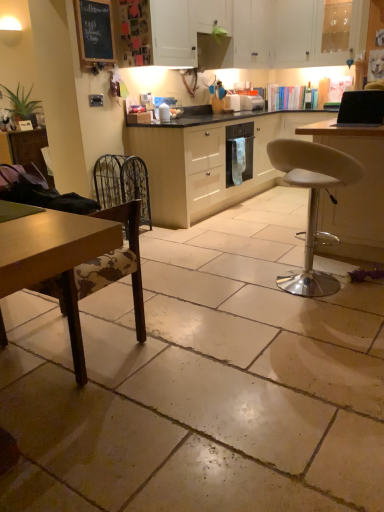
Question: Is black glossy laptop at upper right bigger than metallic oven at center, the second appliance from the front?

Choices:
 (A) yes
 (B) no

Answer: (B)

Question: Does black glossy laptop at upper right have a lesser height compared to metallic oven at center, the second appliance from the front?

Choices:
 (A) no
 (B) yes

Answer: (A)

Question: Considering the relative positions of black glossy laptop at upper right and metallic oven at center, arranged as the 1th appliance when viewed from the back, in the image provided, is black glossy laptop at upper right to the left of metallic oven at center, arranged as the 1th appliance when viewed from the back, from the viewer's perspective?

Choices:
 (A) no
 (B) yes

Answer: (A)

Question: Does black glossy laptop at upper right appear on the right side of metallic oven at center, arranged as the 1th appliance when viewed from the back?

Choices:
 (A) yes
 (B) no

Answer: (A)

Question: Is black glossy laptop at upper right facing away from metallic oven at center, the second appliance from the front?

Choices:
 (A) no
 (B) yes

Answer: (A)

Question: Looking at their shapes, would you say metallic oven at center, arranged as the 1th appliance when viewed from the back, is wider or thinner than black glossy laptop at upper right?

Choices:
 (A) thin
 (B) wide

Answer: (B)

Question: In the image, is metallic oven at center, arranged as the 1th appliance when viewed from the back, on the left side or the right side of black glossy laptop at upper right?

Choices:
 (A) left
 (B) right

Answer: (A)

Question: From the image's perspective, is metallic oven at center, the second appliance from the front, positioned above or below black glossy laptop at upper right?

Choices:
 (A) above
 (B) below

Answer: (A)

Question: Does point (243, 103) appear closer or farther from the camera than point (382, 93)?

Choices:
 (A) closer
 (B) farther

Answer: (B)

Question: In terms of height, does white plastic table at right look taller or shorter compared to metallic oven at center, arranged as the 1th appliance when viewed from the back?

Choices:
 (A) short
 (B) tall

Answer: (B)

Question: Looking at their shapes, would you say white plastic table at right is wider or thinner than metallic oven at center, the second appliance from the front?

Choices:
 (A) wide
 (B) thin

Answer: (A)

Question: Is point (337, 189) closer or farther from the camera than point (241, 108)?

Choices:
 (A) closer
 (B) farther

Answer: (A)

Question: Considering their positions, is white plastic table at right located in front of or behind metallic oven at center, the second appliance from the front?

Choices:
 (A) behind
 (B) front

Answer: (B)

Question: From a real-world perspective, is black glossy laptop at upper right positioned above or below wooden chair at lower left, placed as the second chair when sorted from right to left?

Choices:
 (A) below
 (B) above

Answer: (B)

Question: Visually, is black glossy laptop at upper right positioned to the left or to the right of wooden chair at lower left, placed as the second chair when sorted from right to left?

Choices:
 (A) right
 (B) left

Answer: (A)